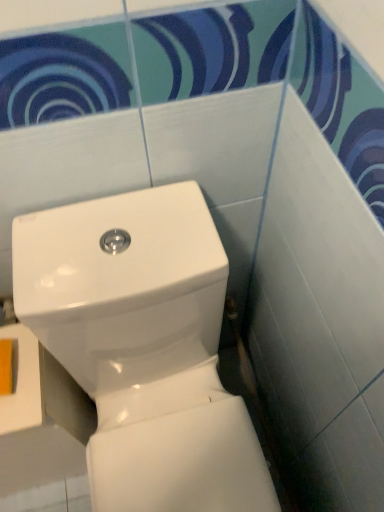
Question: From the image's perspective, is white glossy toilet at center above or below yellow matte toilet paper at lower left?

Choices:
 (A) above
 (B) below

Answer: (B)

Question: Looking at their shapes, would you say white glossy toilet at center is wider or thinner than yellow matte toilet paper at lower left?

Choices:
 (A) wide
 (B) thin

Answer: (A)

Question: Which is correct: white glossy toilet at center is inside yellow matte toilet paper at lower left, or outside of it?

Choices:
 (A) inside
 (B) outside

Answer: (B)

Question: From a real-world perspective, is yellow matte toilet paper at lower left physically located above or below white glossy toilet at center?

Choices:
 (A) above
 (B) below

Answer: (A)

Question: In the image, is yellow matte toilet paper at lower left positioned in front of or behind white glossy toilet at center?

Choices:
 (A) behind
 (B) front

Answer: (A)

Question: Is point (0, 370) closer or farther from the camera than point (155, 384)?

Choices:
 (A) farther
 (B) closer

Answer: (B)

Question: From the image's perspective, is yellow matte toilet paper at lower left located above or below white glossy toilet at center?

Choices:
 (A) above
 (B) below

Answer: (A)